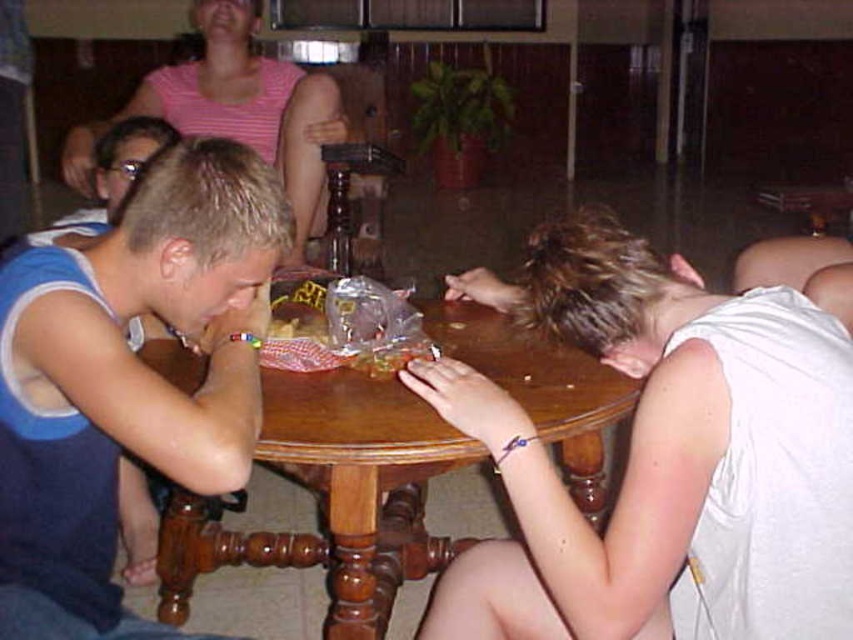
Question: Which point is closer to the camera taking this photo?

Choices:
 (A) click(x=0, y=532)
 (B) click(x=254, y=1)
 (C) click(x=352, y=515)
 (D) click(x=647, y=308)

Answer: (A)

Question: Which point appears farthest from the camera in this image?

Choices:
 (A) (238, 321)
 (B) (804, 566)
 (C) (247, 120)

Answer: (C)

Question: Observing the image, what is the correct spatial positioning of wooden at center in reference to pink striped shirt at upper center?

Choices:
 (A) below
 (B) above

Answer: (A)

Question: Is white matte shirt at lower right to the right of wooden at center from the viewer's perspective?

Choices:
 (A) no
 (B) yes

Answer: (B)

Question: Is blue jersey at left in front of wooden at center?

Choices:
 (A) no
 (B) yes

Answer: (B)

Question: Which object is the farthest from the blue jersey at left?

Choices:
 (A) white matte shirt at lower right
 (B) wooden at center

Answer: (A)